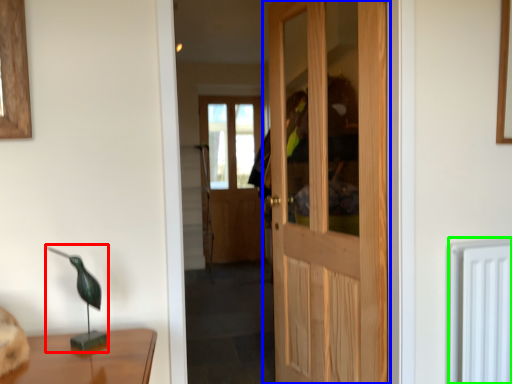
Question: Based on their relative distances, which object is farther from table lamp (highlighted by a red box)? Choose from door (highlighted by a blue box) and radiator (highlighted by a green box).

Choices:
 (A) door
 (B) radiator

Answer: (A)